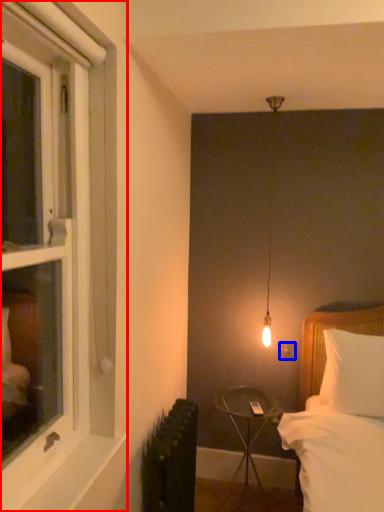
Question: Which object is closer to the camera taking this photo, window (highlighted by a red box) or electric outlet (highlighted by a blue box)?

Choices:
 (A) window
 (B) electric outlet

Answer: (A)